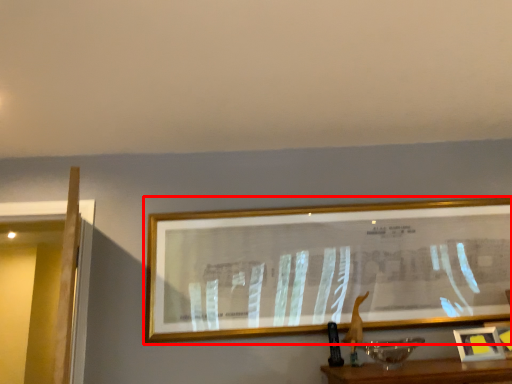
Question: Observing the image, what is the correct spatial positioning of picture frame (annotated by the red box) in reference to picture frame?

Choices:
 (A) left
 (B) right

Answer: (A)